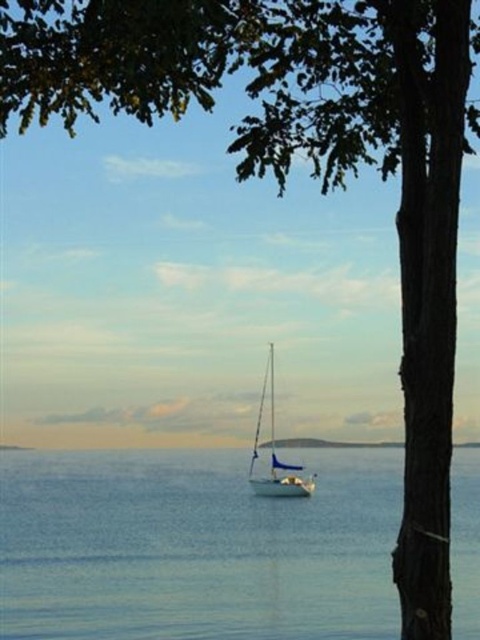
Measure the distance between blue water at center and camera.

23.54 feet

Does blue water at center appear over white glossy sailboat at center?

Correct, blue water at center is located above white glossy sailboat at center.

Describe the element at coordinates (194, 547) in the screenshot. This screenshot has height=640, width=480. I see `blue water at center` at that location.

Identify the location of blue water at center. (194, 547).